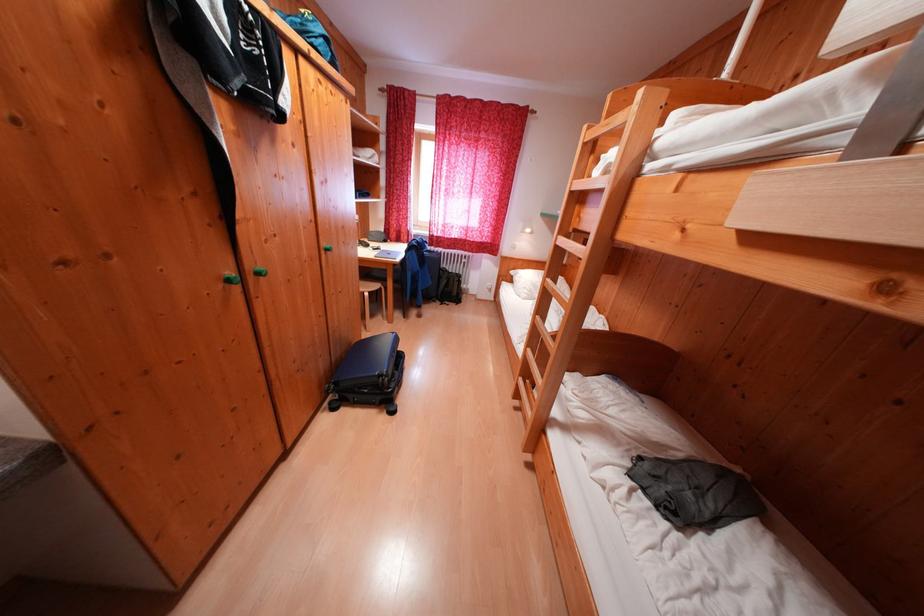
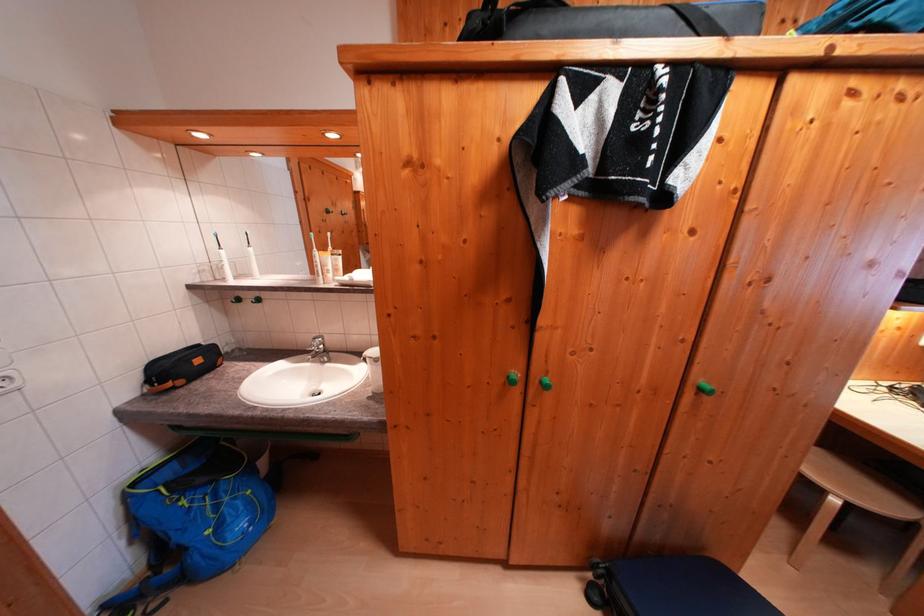
The point at (374, 298) is marked in the first image. Where is the corresponding point in the second image?

(843, 505)